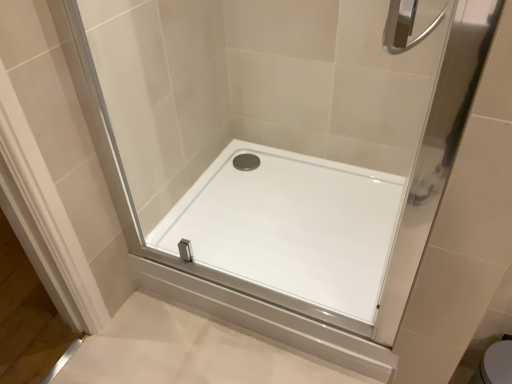
What do you see at coordinates (290, 226) in the screenshot? This screenshot has height=384, width=512. I see `white glossy bathtub at center` at bounding box center [290, 226].

This screenshot has height=384, width=512. I want to click on white glossy bathtub at center, so click(x=290, y=226).

Image resolution: width=512 pixels, height=384 pixels. I want to click on white glossy bathtub at center, so click(290, 226).